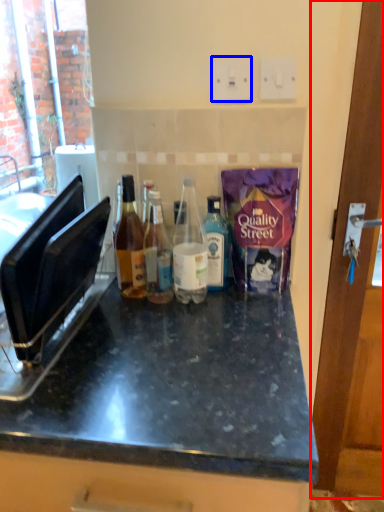
Question: Which of the following is the closest to the observer, door (highlighted by a red box) or electric outlet (highlighted by a blue box)?

Choices:
 (A) door
 (B) electric outlet

Answer: (A)